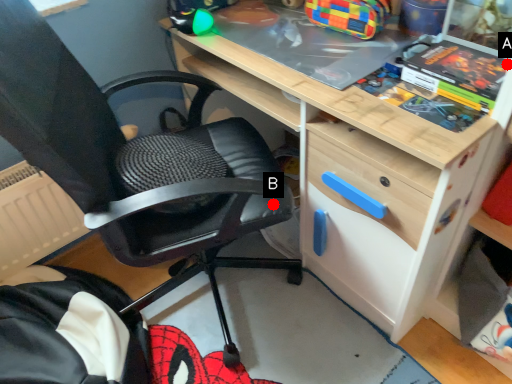
Question: Two points are circled on the image, labeled by A and B beside each circle. Which point is closer to the camera?

Choices:
 (A) A is closer
 (B) B is closer

Answer: (A)